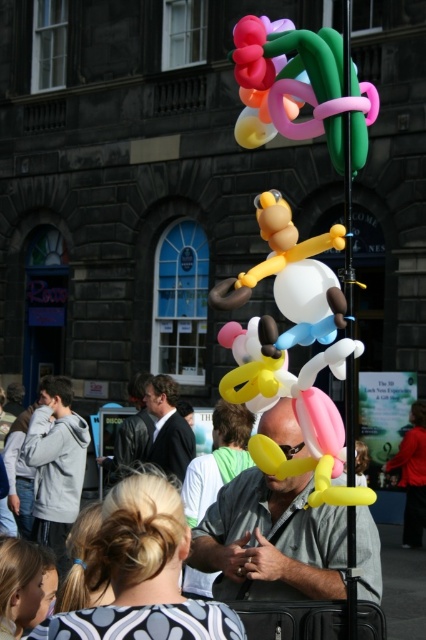
Question: Which of the following is the closest to the observer?

Choices:
 (A) dark gray suit at center
 (B) light gray hoodie at left

Answer: (B)

Question: Is glossy balloon sculpture at upper center below light gray hoodie at left?

Choices:
 (A) no
 (B) yes

Answer: (A)

Question: Among these objects, which one is nearest to the camera?

Choices:
 (A) light gray hoodie at left
 (B) glossy balloon sculpture at upper center

Answer: (B)

Question: Does glossy balloon sculpture at upper center appear over dark gray suit at center?

Choices:
 (A) yes
 (B) no

Answer: (A)

Question: Is glossy balloon sculpture at upper center further to camera compared to dark gray suit at center?

Choices:
 (A) no
 (B) yes

Answer: (A)

Question: Estimate the real-world distances between objects in this image. Which object is closer to the dark gray suit at center?

Choices:
 (A) light gray hoodie at left
 (B) glossy balloon sculpture at upper center

Answer: (A)